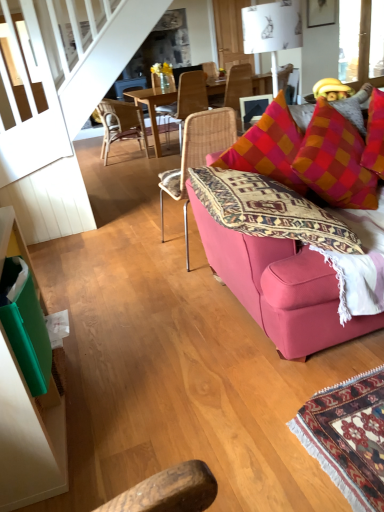
In the scene shown: Measure the distance between wooden chair at center, which ranks as the 2th chair in back-to-front order, and camera.

wooden chair at center, which ranks as the 2th chair in back-to-front order, is 17.51 feet from camera.

Measure the distance between wooden textured chair at center, which appears as the fourth chair when viewed from the front, and camera.

The depth of wooden textured chair at center, which appears as the fourth chair when viewed from the front, is 6.01 meters.

What is the approximate height of woven rattan chair at center, which is counted as the 3th chair, starting from the back?

It is 91.96 centimeters.

Identify the location of wooden chair at center, which ranks as the 2th chair in back-to-front order. (121, 124).

Would you say woven rattan chair at center, which is counted as the 3th chair, starting from the back, is to the left or to the right of white paper lampshade at upper center in the picture?

In the image, woven rattan chair at center, which is counted as the 3th chair, starting from the back, appears on the left side of white paper lampshade at upper center.

From the image's perspective, which is below, woven rattan chair at center, which appears as the 2th chair when viewed from the front, or white paper lampshade at upper center?

white paper lampshade at upper center.

How much distance is there between woven rattan chair at center, which is counted as the 3th chair, starting from the back, and white paper lampshade at upper center?

3.52 meters.

Is woven rattan chair at center, which is counted as the 3th chair, starting from the back, aimed at white paper lampshade at upper center?

No, woven rattan chair at center, which is counted as the 3th chair, starting from the back, is not oriented towards white paper lampshade at upper center.

At what (x,y) coordinates should I click in order to perform the action: click on chair on the right of white paper lampshade at upper center. Please return your answer as a coordinate pair (x, y). This screenshot has height=512, width=384. Looking at the image, I should click on (238, 85).

Does point (232, 75) lie in front of point (256, 40)?

No.

Between wooden textured chair at center, the 1th chair when ordered from back to front, and white paper lampshade at upper center, which one has smaller size?

With smaller size is white paper lampshade at upper center.

Who is taller, pink fabric couch at right or white paper lampshade at upper center?

pink fabric couch at right.

How many degrees apart are the facing directions of pink fabric couch at right and white paper lampshade at upper center?

They differ by 96.5 degrees in their facing directions.

Does pink fabric couch at right appear on the left side of white paper lampshade at upper center?

Indeed, pink fabric couch at right is positioned on the left side of white paper lampshade at upper center.

Consider the image. In terms of width, does pink fabric couch at right look wider or thinner when compared to white paper lampshade at upper center?

Clearly, pink fabric couch at right has more width compared to white paper lampshade at upper center.

Considering the sizes of white paper lampshade at upper center and woven rattan chair at center, which appears as the 2th chair when viewed from the front, in the image, is white paper lampshade at upper center wider or thinner than woven rattan chair at center, which appears as the 2th chair when viewed from the front,?

Clearly, white paper lampshade at upper center has less width compared to woven rattan chair at center, which appears as the 2th chair when viewed from the front.

Considering the sizes of objects white paper lampshade at upper center and woven rattan chair at center, which appears as the 2th chair when viewed from the front, in the image provided, who is shorter, white paper lampshade at upper center or woven rattan chair at center, which appears as the 2th chair when viewed from the front,?

With less height is white paper lampshade at upper center.

Considering the positions of points (268, 42) and (176, 101), is point (268, 42) farther from camera compared to point (176, 101)?

No, (268, 42) is closer to viewer.

From a real-world perspective, is white paper lampshade at upper center below woven rattan chair at center, which is counted as the 3th chair, starting from the back?

No, from a real-world perspective, white paper lampshade at upper center is not below woven rattan chair at center, which is counted as the 3th chair, starting from the back.

Considering the relative sizes of woven rattan chair at center, which is counted as the 3th chair, starting from the back, and wooden textured chair at center, the 1th chair when ordered from back to front, in the image provided, is woven rattan chair at center, which is counted as the 3th chair, starting from the back, wider than wooden textured chair at center, the 1th chair when ordered from back to front,?

No, woven rattan chair at center, which is counted as the 3th chair, starting from the back, is not wider than wooden textured chair at center, the 1th chair when ordered from back to front.

Is wooden textured chair at center, which appears as the fourth chair when viewed from the front, a part of woven rattan chair at center, which appears as the 2th chair when viewed from the front?

No, wooden textured chair at center, which appears as the fourth chair when viewed from the front, is not surrounded by woven rattan chair at center, which appears as the 2th chair when viewed from the front.

Considering the sizes of objects woven rattan chair at center, which appears as the 2th chair when viewed from the front, and wooden textured chair at center, which appears as the fourth chair when viewed from the front, in the image provided, who is shorter, woven rattan chair at center, which appears as the 2th chair when viewed from the front, or wooden textured chair at center, which appears as the fourth chair when viewed from the front,?

Standing shorter between the two is wooden textured chair at center, which appears as the fourth chair when viewed from the front.

Considering the positions of objects woven rattan chair at center, which appears as the 2th chair when viewed from the front, and wooden textured chair at center, the 1th chair when ordered from back to front, in the image provided, who is more to the right, woven rattan chair at center, which appears as the 2th chair when viewed from the front, or wooden textured chair at center, the 1th chair when ordered from back to front,?

wooden textured chair at center, the 1th chair when ordered from back to front.

Does orange-red checkered throw pillow at upper right have a greater width compared to woven rattan chair at center, the 4th chair viewed from the back?

No.

Is orange-red checkered throw pillow at upper right at the right side of woven rattan chair at center, the 4th chair viewed from the back?

Yes, orange-red checkered throw pillow at upper right is to the right of woven rattan chair at center, the 4th chair viewed from the back.

Is pink fabric couch at right positioned far away from orange-red checkered throw pillow at upper right?

No, pink fabric couch at right is not far from orange-red checkered throw pillow at upper right.

Is orange-red checkered throw pillow at upper right completely or partially inside pink fabric couch at right?

No, orange-red checkered throw pillow at upper right is not surrounded by pink fabric couch at right.

From the image's perspective, which is above, pink fabric couch at right or orange-red checkered throw pillow at upper right?

orange-red checkered throw pillow at upper right appears higher in the image.

Considering the relative positions of pink fabric couch at right and orange-red checkered throw pillow at upper right in the image provided, is pink fabric couch at right to the left or to the right of orange-red checkered throw pillow at upper right?

Clearly, pink fabric couch at right is on the left of orange-red checkered throw pillow at upper right in the image.

Locate an element on the screen. lamp that is below the woven rattan chair at center, which appears as the 2th chair when viewed from the front (from the image's perspective) is located at coordinates (272, 30).

Which chair is the 4th one when counting from the back of the white paper lampshade at upper center? Please provide its 2D coordinates.

[(238, 85)]

From the image, which object appears to be nearer to wooden chair at center, positioned as the third chair in front-to-back order, orange-red checkered throw pillow at upper right or woven rattan chair at center, which is counted as the 3th chair, starting from the back?

Based on the image, woven rattan chair at center, which is counted as the 3th chair, starting from the back, appears to be nearer to wooden chair at center, positioned as the third chair in front-to-back order.

Considering their positions, is woven rattan chair at center, which is counted as the 3th chair, starting from the back, positioned further to orange-red checkered throw pillow at upper right than wooden chair at center, positioned as the third chair in front-to-back order?

wooden chair at center, positioned as the third chair in front-to-back order, lies further to orange-red checkered throw pillow at upper right than the other object.

When comparing their distances from woven rattan chair at center, which appears as the 2th chair when viewed from the front, does wooden chair at center, positioned as the third chair in front-to-back order, or wooden textured chair at center, the 1th chair when ordered from back to front, seem closer?

The object closer to woven rattan chair at center, which appears as the 2th chair when viewed from the front, is wooden textured chair at center, the 1th chair when ordered from back to front.

Considering their positions, is orange-red checkered throw pillow at upper right positioned closer to white paper lampshade at upper center than woven rattan chair at center, the 4th chair viewed from the back?

Based on the image, woven rattan chair at center, the 4th chair viewed from the back, appears to be nearer to white paper lampshade at upper center.

From the image, which object appears to be nearer to white paper lampshade at upper center, pink fabric couch at right or wooden textured chair at center, the 1th chair when ordered from back to front?

pink fabric couch at right is positioned closer to the anchor white paper lampshade at upper center.

Looking at the image, which one is located further to wooden textured chair at center, which appears as the fourth chair when viewed from the front, pink fabric couch at right or orange-red checkered throw pillow at upper right?

Based on the image, pink fabric couch at right appears to be further to wooden textured chair at center, which appears as the fourth chair when viewed from the front.

When comparing their distances from wooden chair at center, positioned as the third chair in front-to-back order, does woven rattan chair at center, which appears as the 2th chair when viewed from the front, or pink fabric couch at right seem further?

pink fabric couch at right lies further to wooden chair at center, positioned as the third chair in front-to-back order, than the other object.

Which object lies further to the anchor point woven rattan chair at center, the 1th chair in the front-to-back sequence, orange-red checkered throw pillow at upper right or wooden textured chair at center, the 1th chair when ordered from back to front?

wooden textured chair at center, the 1th chair when ordered from back to front, is further to woven rattan chair at center, the 1th chair in the front-to-back sequence.

Locate an element on the screen. lamp between pink fabric couch at right and woven rattan chair at center, which appears as the 2th chair when viewed from the front, along the z-axis is located at coordinates (272, 30).

I want to click on lamp located between orange-red checkered throw pillow at upper right and wooden chair at center, positioned as the third chair in front-to-back order, in the depth direction, so click(272, 30).

Where is `throw pillow between pink fabric couch at right and woven rattan chair at center, which is counted as the 3th chair, starting from the back, in the front-back direction`? The width and height of the screenshot is (384, 512). throw pillow between pink fabric couch at right and woven rattan chair at center, which is counted as the 3th chair, starting from the back, in the front-back direction is located at coordinates (335, 161).

At what (x,y) coordinates should I click in order to perform the action: click on lamp between orange-red checkered throw pillow at upper right and wooden textured chair at center, which appears as the fourth chair when viewed from the front, in the front-back direction. Please return your answer as a coordinate pair (x, y). Image resolution: width=384 pixels, height=512 pixels. Looking at the image, I should click on (272, 30).